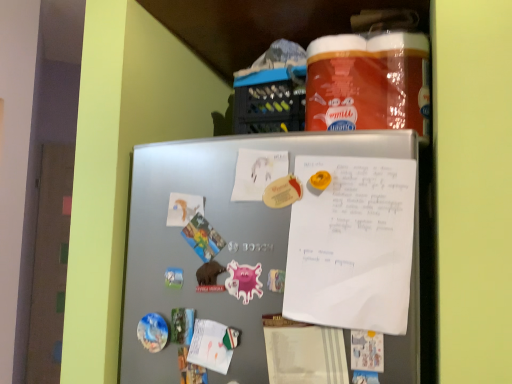
Question: Based on their positions, is white matte paper at center, acting as the 2th paper starting from the left, located to the left or right of satin silver fridge at center?

Choices:
 (A) left
 (B) right

Answer: (A)

Question: In terms of size, does white matte paper at center, the first paper from the right, appear bigger or smaller than satin silver fridge at center?

Choices:
 (A) small
 (B) big

Answer: (A)

Question: Based on their relative distances, which object is farther from the white matte paper at center, acting as the 2th paper starting from the left?

Choices:
 (A) white matte paper at upper left, which appears as the second paper when viewed from the right
 (B) satin silver fridge at center
 (C) white paper at upper center

Answer: (B)

Question: Which of these objects is positioned closest to the white matte paper at center, acting as the second paper starting from the bottom?

Choices:
 (A) satin silver fridge at center
 (B) white matte paper at upper left, which appears as the second paper when viewed from the right
 (C) white paper at upper center

Answer: (B)